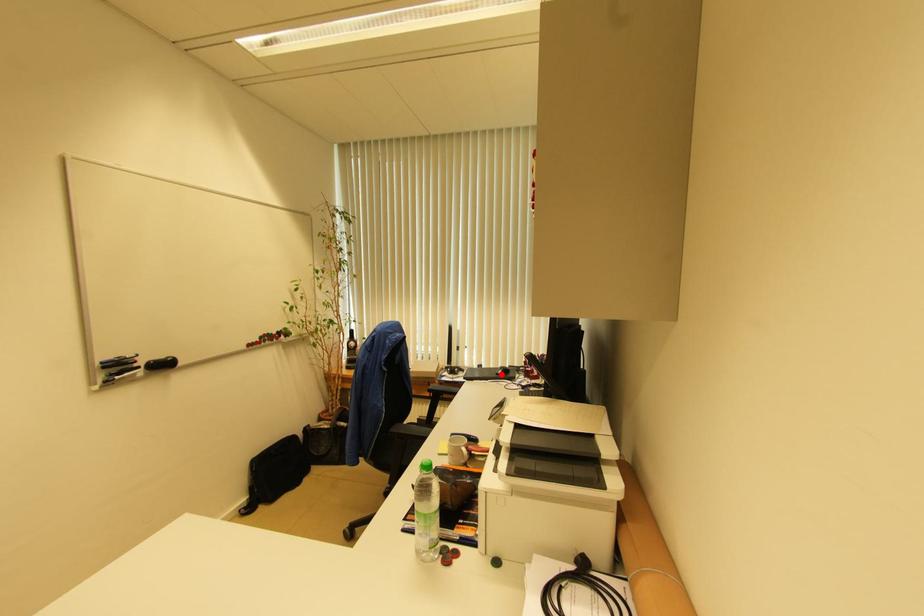
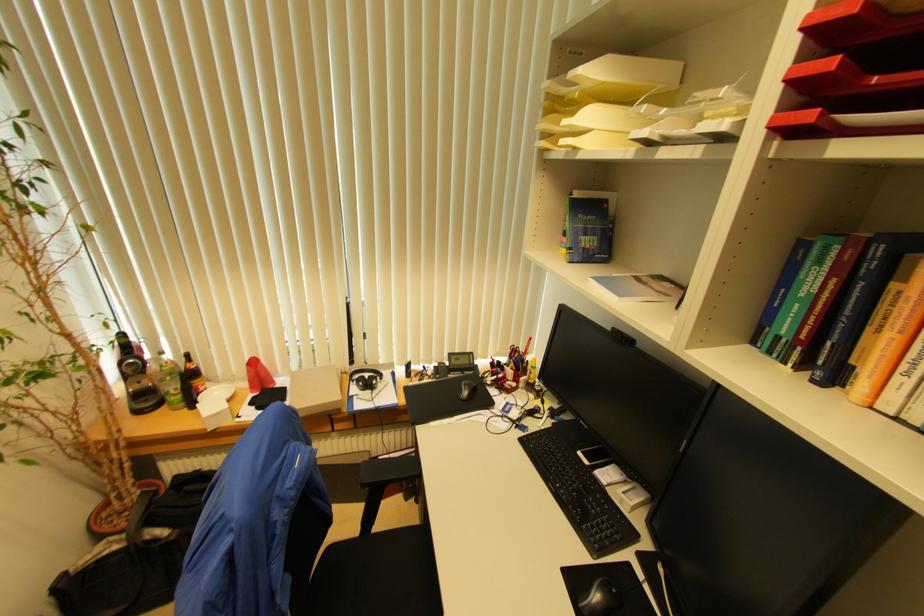
Question: A red point is marked in image1. In image2, is the corresponding 3D point closer to the camera or farther? Reply with the corresponding letter.

Choices:
 (A) The corresponding 3D point is closer.
 (B) The corresponding 3D point is farther.

Answer: (B)